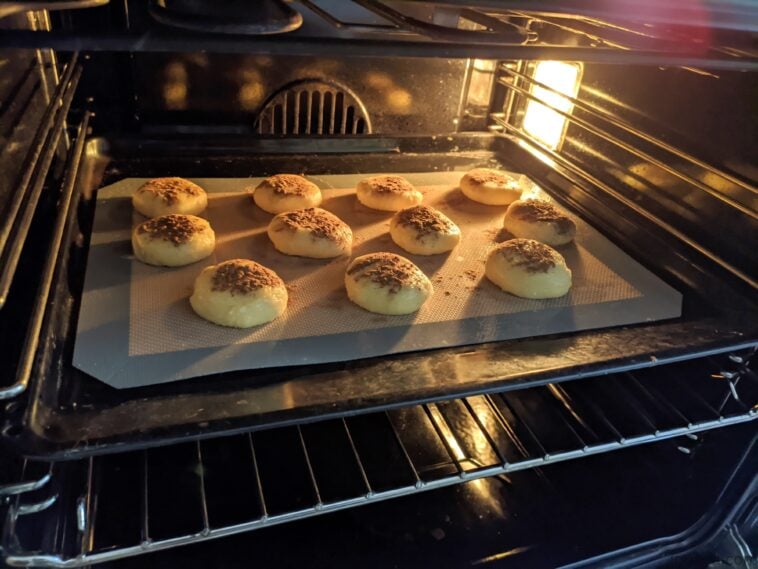
You are a GUI agent. You are given a task and a screenshot of the screen. Output one action in this format:
    pyautogui.click(x=<x>, y=<y>)
    Task: Click on the baked goods on back row in oven
    
    Given the screenshot: What is the action you would take?
    pyautogui.click(x=168, y=191), pyautogui.click(x=295, y=187), pyautogui.click(x=380, y=189), pyautogui.click(x=490, y=174)